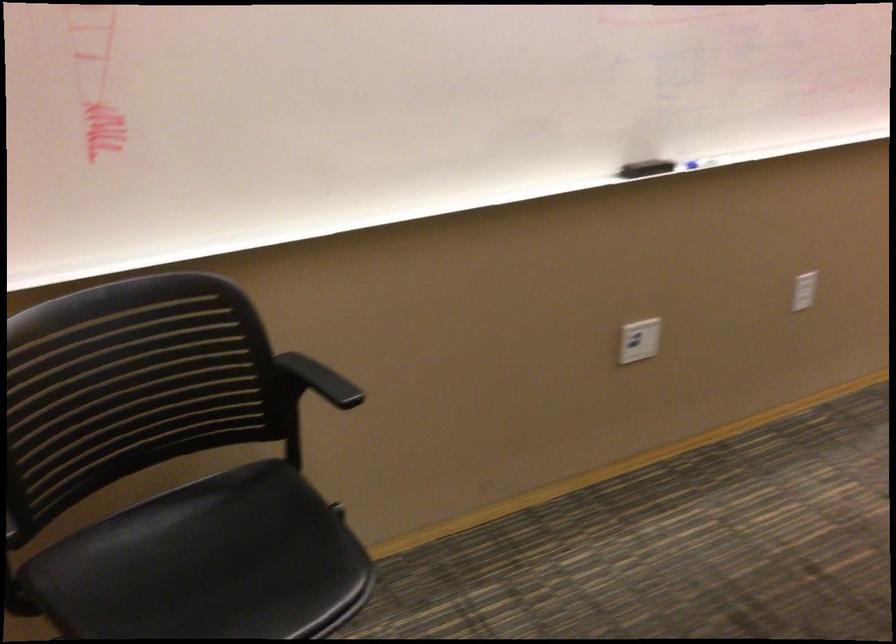
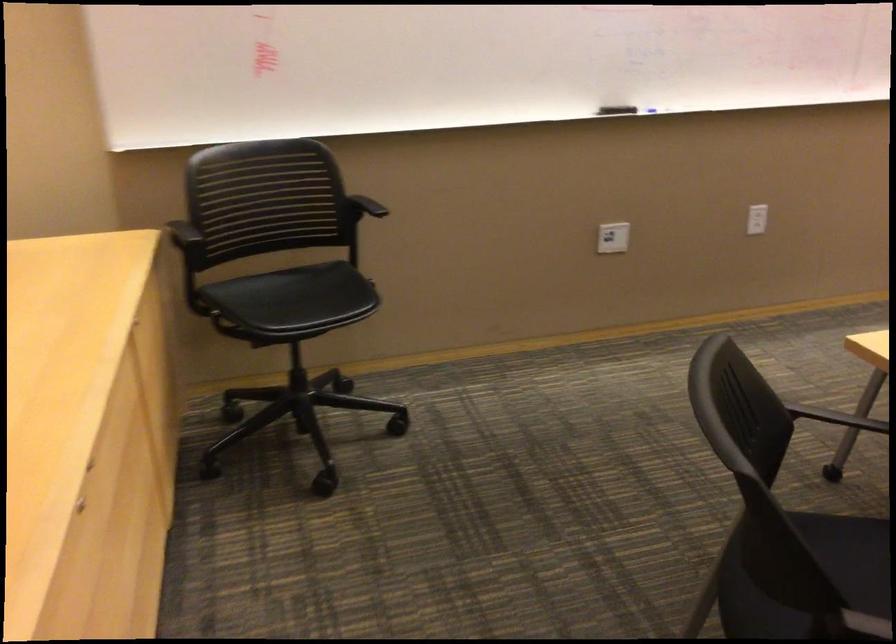
The point at (296, 386) is marked in the first image. Where is the corresponding point in the second image?

(366, 205)